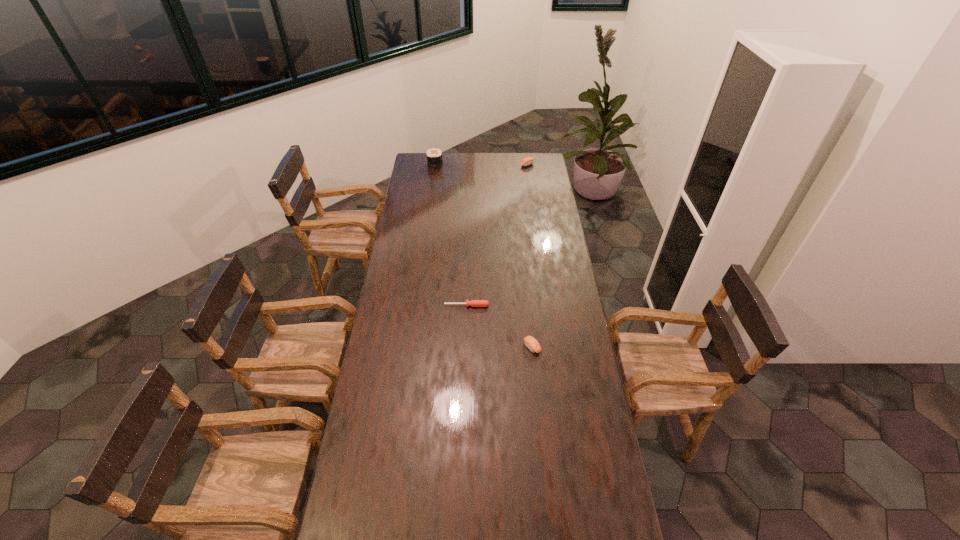
This screenshot has width=960, height=540. I want to click on vacant space located on the back of the shortest sushi, so click(x=529, y=320).

At what (x,y) coordinates should I click in order to perform the action: click on vacant space located on the right of the shortest object. Please return your answer as a coordinate pair (x, y). The height and width of the screenshot is (540, 960). Looking at the image, I should click on (572, 306).

Locate an element on the screen. object located at the left edge is located at coordinates click(x=434, y=156).

You are a GUI agent. You are given a task and a screenshot of the screen. Output one action in this format:
    pyautogui.click(x=<x>, y=<y>)
    Task: Click on the object that is at the right edge
    This screenshot has height=540, width=960.
    Given the screenshot: What is the action you would take?
    pyautogui.click(x=527, y=161)

Find the location of `object located at the far left corner`. object located at the far left corner is located at coordinates coord(434,156).

At what (x,y) coordinates should I click in order to perform the action: click on object positioned at the far right corner. Please return your answer as a coordinate pair (x, y). The height and width of the screenshot is (540, 960). Looking at the image, I should click on (527, 161).

This screenshot has height=540, width=960. Find the location of `vacant space at the far edge`. vacant space at the far edge is located at coordinates (463, 158).

You are a GUI agent. You are given a task and a screenshot of the screen. Output one action in this format:
    pyautogui.click(x=<x>, y=<y>)
    Task: Click on the free region at the left edge of the desktop
    
    Given the screenshot: What is the action you would take?
    pyautogui.click(x=394, y=392)

This screenshot has height=540, width=960. In order to click on free space at the right edge of the desktop in this screenshot , I will do `click(595, 442)`.

In the image, there is a desktop. Identify the location of free space at the far left corner. This screenshot has height=540, width=960. (424, 172).